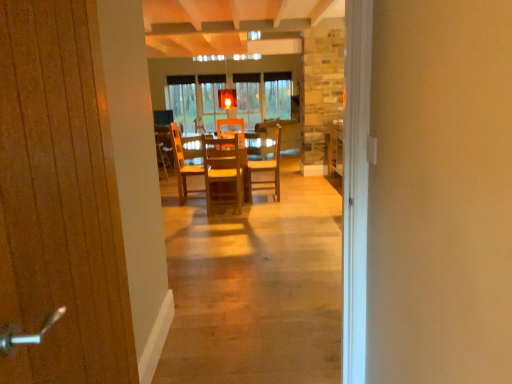
Question: Can you confirm if wooden door at left is wider than wooden chair at center?

Choices:
 (A) yes
 (B) no

Answer: (B)

Question: Considering the relative sizes of wooden door at left and wooden chair at center in the image provided, is wooden door at left bigger than wooden chair at center?

Choices:
 (A) no
 (B) yes

Answer: (A)

Question: Does wooden door at left have a smaller size compared to wooden chair at center?

Choices:
 (A) no
 (B) yes

Answer: (B)

Question: Is wooden door at left far from wooden chair at center?

Choices:
 (A) no
 (B) yes

Answer: (B)

Question: Is wooden door at left in front of wooden chair at center?

Choices:
 (A) no
 (B) yes

Answer: (B)

Question: Is wooden door at left facing away from wooden chair at center?

Choices:
 (A) yes
 (B) no

Answer: (B)

Question: Considering the relative positions of wooden chair at center, the 2th chair positioned from the left, and wooden chair at center in the image provided, is wooden chair at center, the 2th chair positioned from the left, to the right of wooden chair at center from the viewer's perspective?

Choices:
 (A) no
 (B) yes

Answer: (B)

Question: Does wooden chair at center, arranged as the first chair when viewed from the right, appear on the left side of wooden chair at center?

Choices:
 (A) yes
 (B) no

Answer: (B)

Question: From the image's perspective, is wooden chair at center, which appears as the first chair when viewed from the back, under wooden chair at center?

Choices:
 (A) no
 (B) yes

Answer: (B)

Question: Is wooden chair at center, arranged as the first chair when viewed from the right, not within wooden chair at center?

Choices:
 (A) no
 (B) yes

Answer: (B)

Question: Is wooden chair at center, arranged as the first chair when viewed from the right, oriented away from wooden chair at center?

Choices:
 (A) yes
 (B) no

Answer: (B)

Question: Is wooden chair at center, arranged as the 2th chair when viewed from the front, further to the viewer compared to wooden chair at center?

Choices:
 (A) yes
 (B) no

Answer: (B)

Question: Is wooden chair at center, arranged as the 2th chair when viewed from the front, shorter than wooden chair at center, the 1th chair positioned from the left?

Choices:
 (A) yes
 (B) no

Answer: (B)